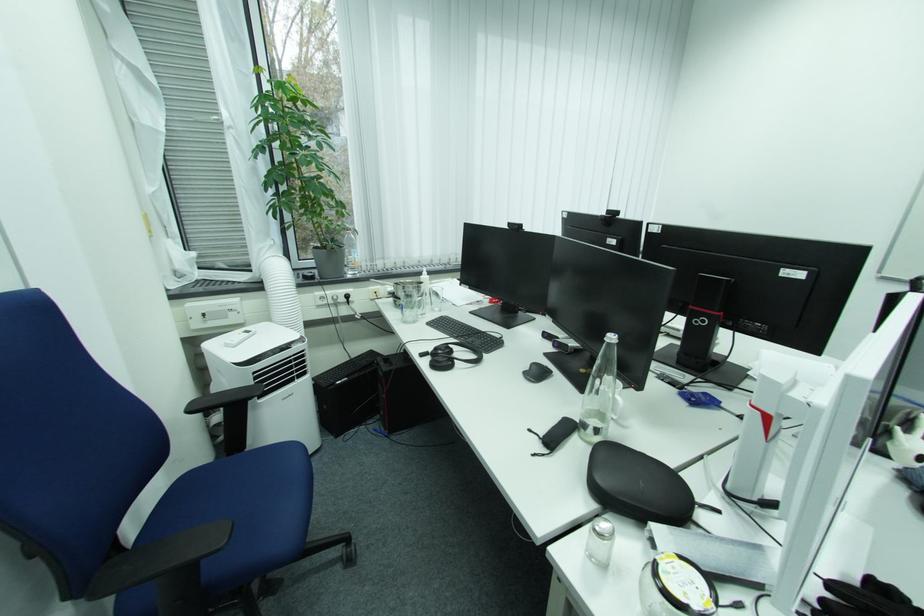
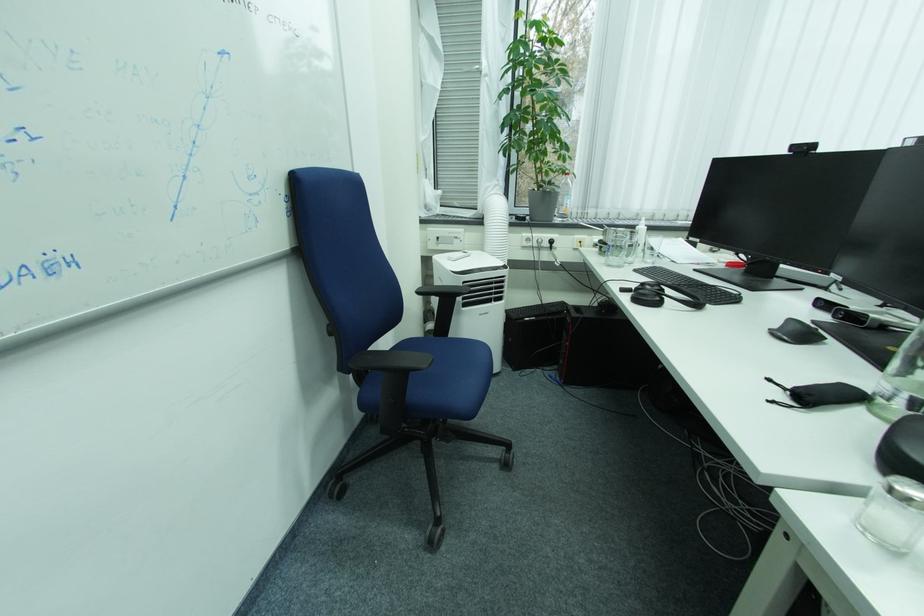
Where in the second image is the point corresponding to the point at 429,277 from the first image?

(643, 227)